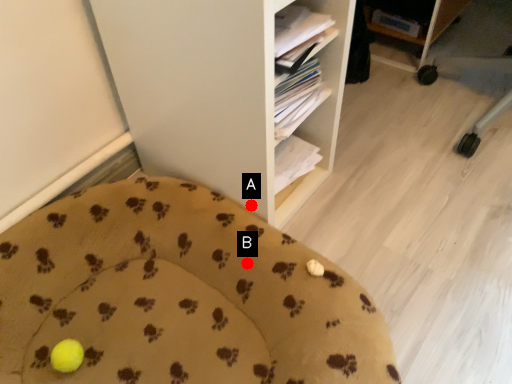
Question: Two points are circled on the image, labeled by A and B beside each circle. Which point appears farthest from the camera in this image?

Choices:
 (A) A is further
 (B) B is further

Answer: (A)